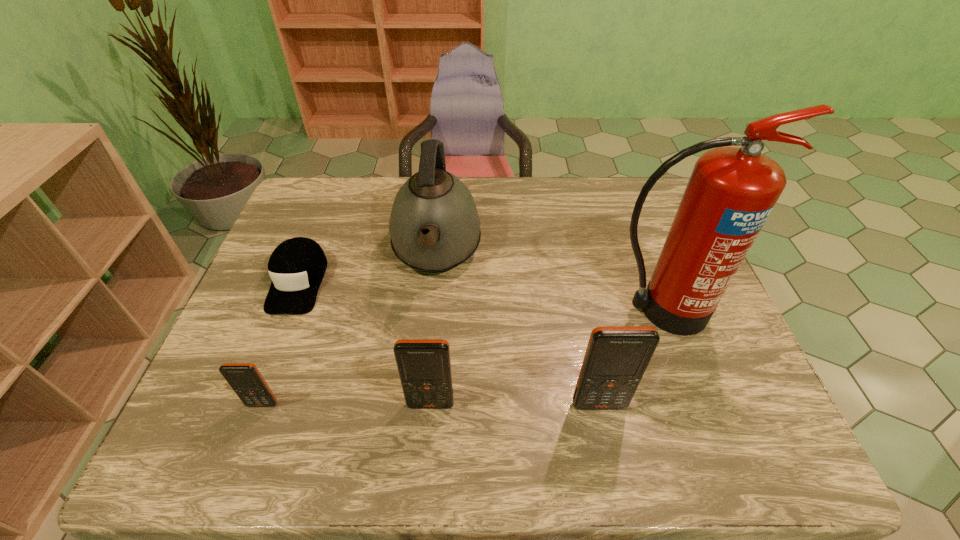
Locate an element on the screen. This screenshot has height=540, width=960. free location at the right edge is located at coordinates (685, 375).

In the image, there is a desktop. Where is `vacant space at the far left corner`? This screenshot has width=960, height=540. vacant space at the far left corner is located at coordinates (339, 193).

You are a GUI agent. You are given a task and a screenshot of the screen. Output one action in this format:
    pyautogui.click(x=<x>, y=<y>)
    Task: Click on the free point at the far right corner
    This screenshot has height=540, width=960.
    Given the screenshot: What is the action you would take?
    pyautogui.click(x=636, y=182)

Find the location of a particular element. free space that is in between the second cellular telephone from right to left and the fifth object from left to right is located at coordinates pyautogui.click(x=515, y=404).

Locate an element on the screen. The image size is (960, 540). free space that is in between the shortest cellular telephone and the second cellular telephone from right to left is located at coordinates (347, 404).

Locate an element on the screen. vacant area that lies between the fifth tallest object and the tallest object is located at coordinates (462, 357).

Locate an element on the screen. This screenshot has width=960, height=540. free space between the second shortest object and the second tallest cellular telephone is located at coordinates (347, 404).

At what (x,y) coordinates should I click in order to perform the action: click on blank region between the shortest object and the second shortest object. Please return your answer as a coordinate pair (x, y). Looking at the image, I should click on (280, 343).

Where is `vacant space that is in between the shortest object and the kettle`? vacant space that is in between the shortest object and the kettle is located at coordinates (368, 267).

The width and height of the screenshot is (960, 540). I want to click on empty location between the second cellular telephone from left to right and the second shortest object, so (x=347, y=404).